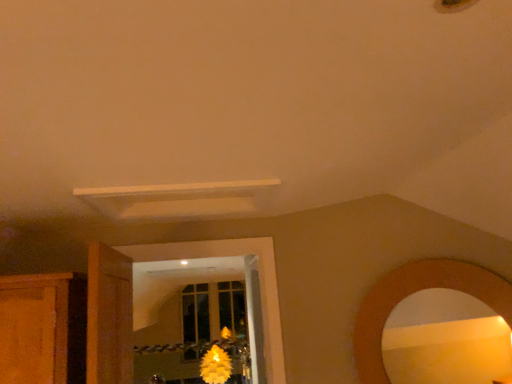
Question: Can you confirm if wooden door at left is thinner than yellow matte flower at center?

Choices:
 (A) no
 (B) yes

Answer: (B)

Question: Is wooden door at left oriented away from yellow matte flower at center?

Choices:
 (A) yes
 (B) no

Answer: (B)

Question: Considering the relative sizes of wooden door at left and yellow matte flower at center in the image provided, is wooden door at left bigger than yellow matte flower at center?

Choices:
 (A) no
 (B) yes

Answer: (A)

Question: Does wooden door at left lie behind yellow matte flower at center?

Choices:
 (A) yes
 (B) no

Answer: (B)

Question: Is wooden door at left facing towards yellow matte flower at center?

Choices:
 (A) no
 (B) yes

Answer: (A)

Question: From the image's perspective, is wooden door at left located beneath yellow matte flower at center?

Choices:
 (A) yes
 (B) no

Answer: (B)

Question: Is wooden mirror at lower right oriented towards yellow matte flower at center?

Choices:
 (A) no
 (B) yes

Answer: (A)

Question: Can yellow matte flower at center be found inside wooden mirror at lower right?

Choices:
 (A) yes
 (B) no

Answer: (B)

Question: Does wooden mirror at lower right lie in front of yellow matte flower at center?

Choices:
 (A) no
 (B) yes

Answer: (B)

Question: From the image's perspective, is wooden mirror at lower right beneath yellow matte flower at center?

Choices:
 (A) no
 (B) yes

Answer: (A)

Question: From a real-world perspective, is wooden mirror at lower right on yellow matte flower at center?

Choices:
 (A) yes
 (B) no

Answer: (A)

Question: Is wooden mirror at lower right facing away from yellow matte flower at center?

Choices:
 (A) no
 (B) yes

Answer: (A)

Question: Is yellow matte flower at center closer to the viewer compared to wooden mirror at lower right?

Choices:
 (A) yes
 (B) no

Answer: (B)